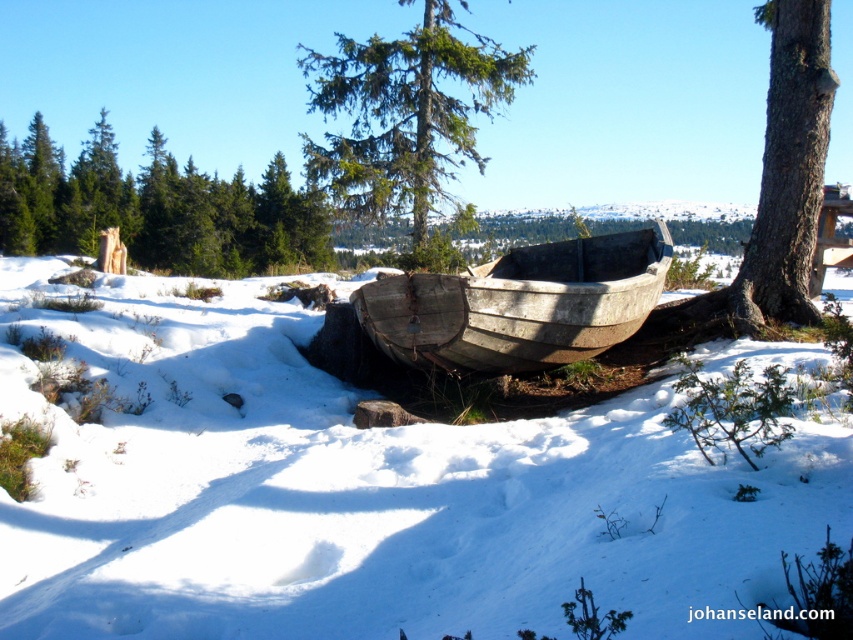
Question: Which point appears farthest from the camera in this image?

Choices:
 (A) (151, 545)
 (B) (798, 51)
 (C) (525, 81)

Answer: (C)

Question: Is white powdery snow at center below weathered wood boat at center?

Choices:
 (A) yes
 (B) no

Answer: (A)

Question: Estimate the real-world distances between objects in this image. Which object is farther from the brown rough tree trunk at right?

Choices:
 (A) white powdery snow at center
 (B) brown wood tree at left
 (C) green textured pine tree at center

Answer: (B)

Question: Which object is the closest to the brown wood tree at left?

Choices:
 (A) green textured pine tree at center
 (B) brown rough tree trunk at right
 (C) weathered wood boat at center

Answer: (A)

Question: Can you confirm if white powdery snow at center is positioned above green textured pine tree at center?

Choices:
 (A) yes
 (B) no

Answer: (B)

Question: Does green textured pine tree at center appear under brown rough tree trunk at right?

Choices:
 (A) yes
 (B) no

Answer: (A)